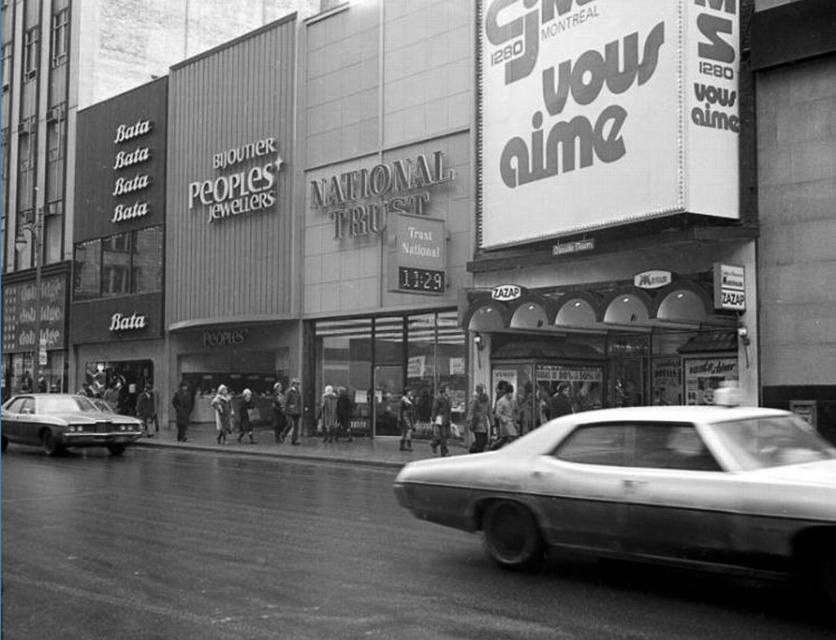
Is shiny white car at center shorter than shiny chrome sedan at left?

Yes.

You are a GUI agent. You are given a task and a screenshot of the screen. Output one action in this format:
    pyautogui.click(x=<x>, y=<y>)
    Task: Click on the shiny white car at center
    
    Given the screenshot: What is the action you would take?
    pyautogui.click(x=646, y=492)

Find the location of a particular element. The width and height of the screenshot is (836, 640). shiny white car at center is located at coordinates (646, 492).